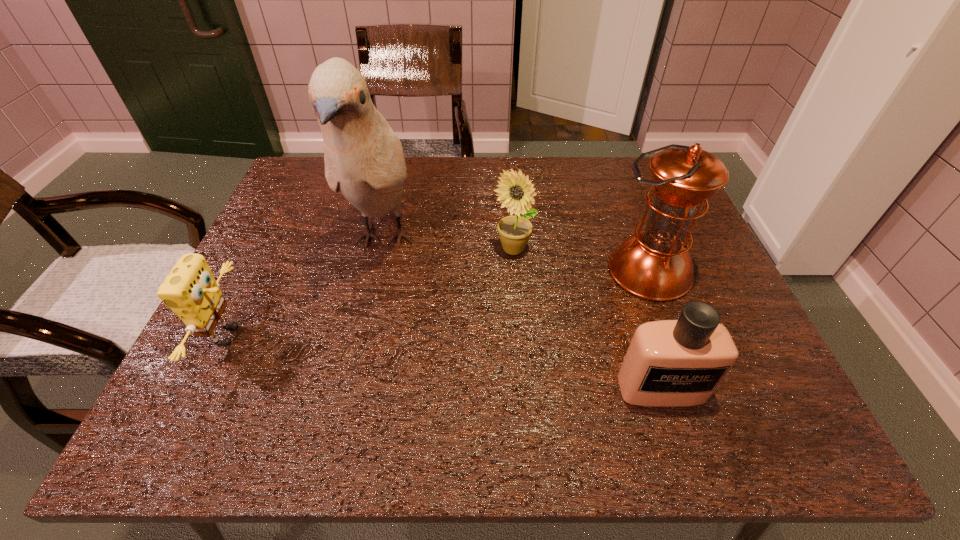
You are a GUI agent. You are given a task and a screenshot of the screen. Output one action in this format:
    pyautogui.click(x=<x>, y=<y>)
    Task: Click on the vacant area that lies between the second object from left to right and the sunflower
    
    Given the screenshot: What is the action you would take?
    pyautogui.click(x=448, y=245)

You are a GUI agent. You are given a task and a screenshot of the screen. Output one action in this format:
    pyautogui.click(x=<x>, y=<y>)
    Task: Click on the unoccupied area between the tallest object and the third object from right to left
    The image size is (960, 540).
    Given the screenshot: What is the action you would take?
    [x=448, y=245]

You are a GUI agent. You are given a task and a screenshot of the screen. Output one action in this format:
    pyautogui.click(x=<x>, y=<y>)
    Task: Click on the free space between the perfume and the sponge
    This screenshot has height=540, width=960.
    Given the screenshot: What is the action you would take?
    pyautogui.click(x=445, y=362)

Where is `object that stands as the closest to the second tallest object`? The width and height of the screenshot is (960, 540). object that stands as the closest to the second tallest object is located at coordinates click(516, 191).

Where is `object that is the second nearest to the sunflower`? object that is the second nearest to the sunflower is located at coordinates (364, 159).

Where is `free space that satisfies the following two spatial constraints: 1. on the face of the sunflower; 2. on the left side of the oil lamp`? free space that satisfies the following two spatial constraints: 1. on the face of the sunflower; 2. on the left side of the oil lamp is located at coordinates (515, 271).

Identify the location of vacant space that satisfies the following two spatial constraints: 1. on the face of the parakeet; 2. on the face of the leftmost object. pyautogui.click(x=362, y=335).

The width and height of the screenshot is (960, 540). I want to click on vacant position in the image that satisfies the following two spatial constraints: 1. on the face of the third object from right to left; 2. on the right side of the fourth shortest object, so click(515, 271).

Identify the location of free space that satisfies the following two spatial constraints: 1. on the face of the fourth object from right to left; 2. on the face of the leftmost object. The height and width of the screenshot is (540, 960). (362, 335).